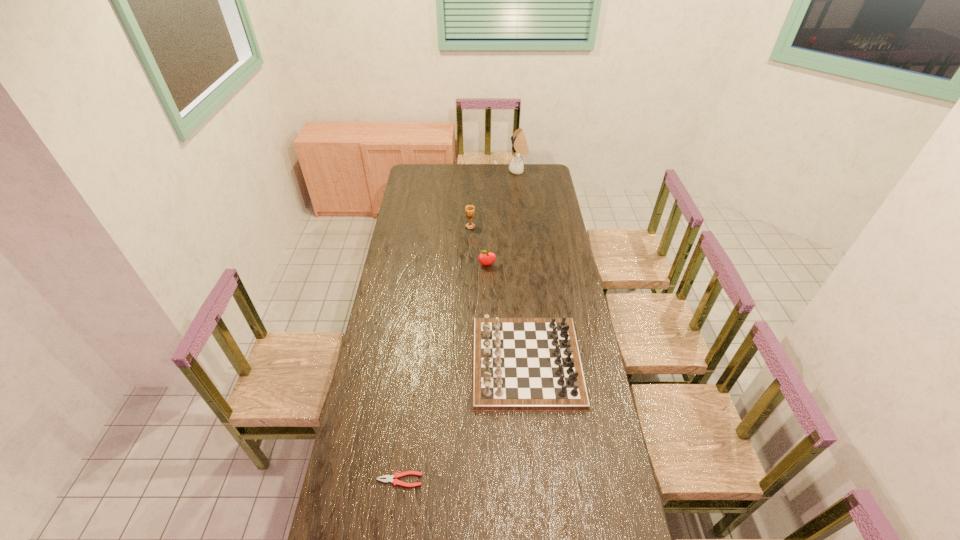
The width and height of the screenshot is (960, 540). What are the coordinates of `vacant region between the pliers and the chalice` in the screenshot? It's located at (435, 353).

Find the location of `free space between the third farthest object and the chalice`. free space between the third farthest object and the chalice is located at coordinates (479, 246).

Locate an element on the screen. Image resolution: width=960 pixels, height=540 pixels. object that stands as the third closest to the apple is located at coordinates (519, 144).

Where is `object that is the fourth closest to the third farthest object`? Image resolution: width=960 pixels, height=540 pixels. object that is the fourth closest to the third farthest object is located at coordinates (389, 478).